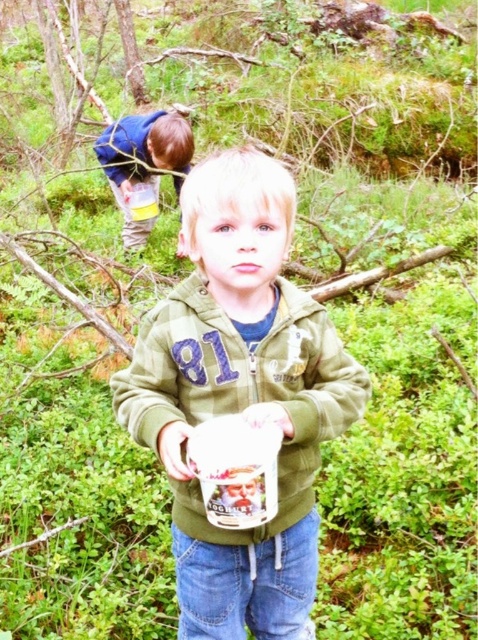
You are a hiker who needs to determine which clothing item is more suitable for a narrow cave passage. The green matte jacket at center and the blue denim pants at upper left are available. Which one is smaller in size and thus easier to maneuver through the tight space?

The green matte jacket at center has a smaller size compared to the blue denim pants at upper left, so it is easier to maneuver through the tight space.